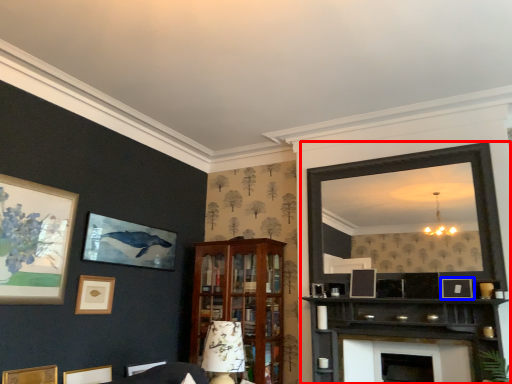
Question: Which object appears closest to the camera in this image, entertainment center (highlighted by a red box) or picture frame (highlighted by a blue box)?

Choices:
 (A) entertainment center
 (B) picture frame

Answer: (A)